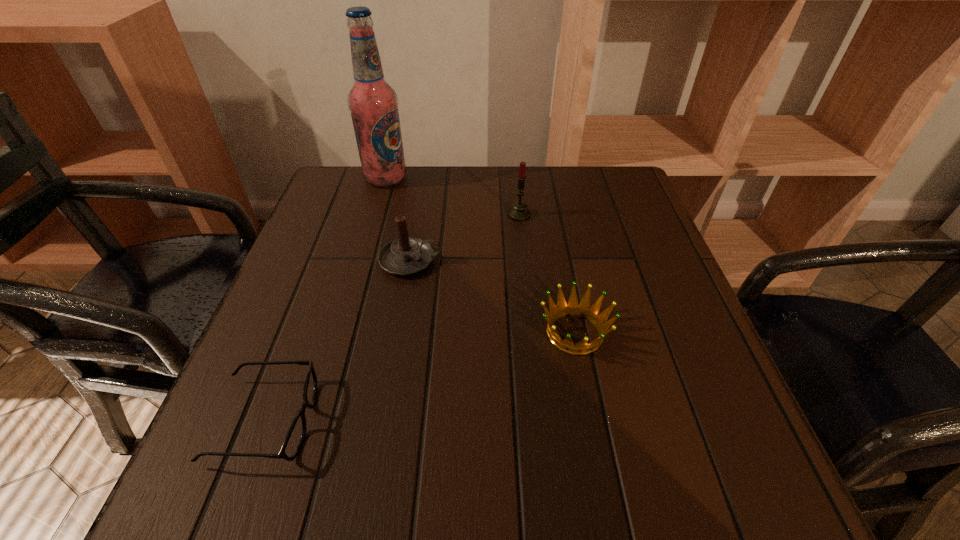
You are a GUI agent. You are given a task and a screenshot of the screen. Output one action in this format:
    pyautogui.click(x=<x>, y=<y>)
    Task: Click on the alcohol
    
    Given the screenshot: What is the action you would take?
    pyautogui.click(x=373, y=103)

Identify the location of the tallest object. (373, 103).

The width and height of the screenshot is (960, 540). I want to click on the right candle, so click(x=518, y=212).

Locate an element on the screen. The height and width of the screenshot is (540, 960). the farther candle is located at coordinates (518, 212).

You are a GUI agent. You are given a task and a screenshot of the screen. Output one action in this format:
    pyautogui.click(x=<x>, y=<y>)
    Task: Click on the third shortest object
    
    Given the screenshot: What is the action you would take?
    pyautogui.click(x=404, y=256)

Find the location of a particular element. the nearer candle is located at coordinates (404, 256).

Where is `the second nearest object`? This screenshot has height=540, width=960. the second nearest object is located at coordinates [x=583, y=309].

Identify the location of crown. (583, 309).

Locate an element on the screen. The image size is (960, 540). the shortest object is located at coordinates (294, 439).

I want to click on spectacles, so click(294, 439).